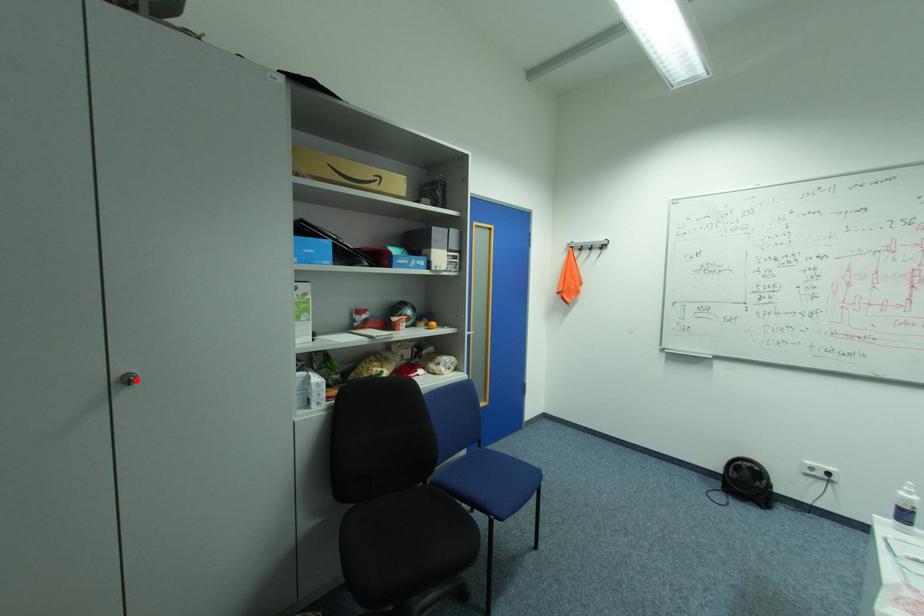
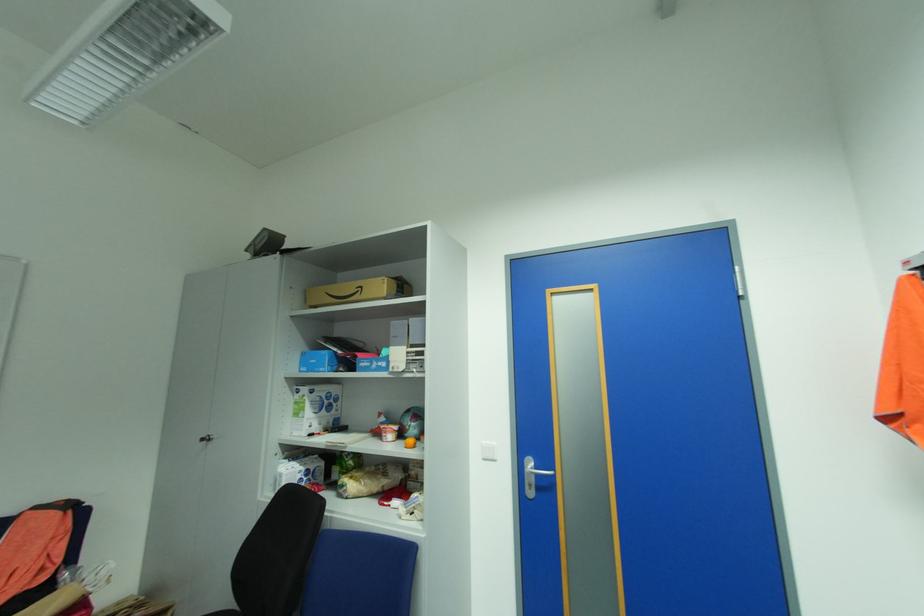
Where in the second image is the point corresponding to the highlighted location from the first image?

(213, 439)